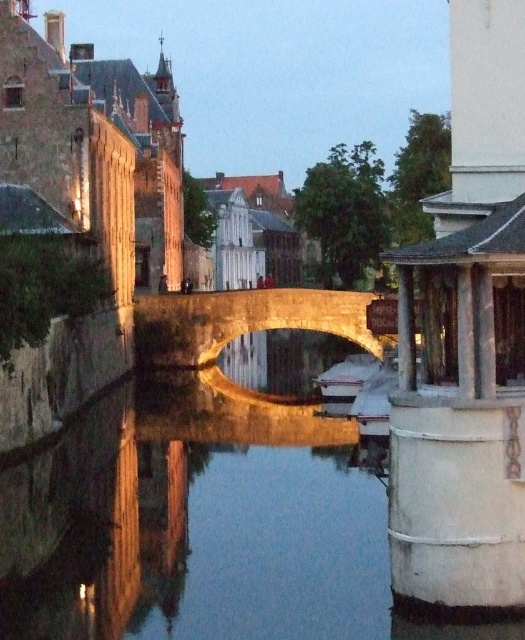
Question: Among these points, which one is nearest to the camera?

Choices:
 (A) (203, 348)
 (B) (326, 390)
 (C) (374, 488)

Answer: (C)

Question: Which is farther from the smooth concrete river at center?

Choices:
 (A) stone arch bridge at center
 (B) white plastic boat at center

Answer: (B)

Question: Among these points, which one is nearest to the camera?

Choices:
 (A) [155, 296]
 (B) [273, 513]

Answer: (B)

Question: Does stone arch bridge at center appear over white plastic boat at center?

Choices:
 (A) yes
 (B) no

Answer: (A)

Question: Can you confirm if smooth concrete river at center is bigger than stone arch bridge at center?

Choices:
 (A) no
 (B) yes

Answer: (A)

Question: Is smooth concrete river at center positioned before white plastic boat at center?

Choices:
 (A) yes
 (B) no

Answer: (A)